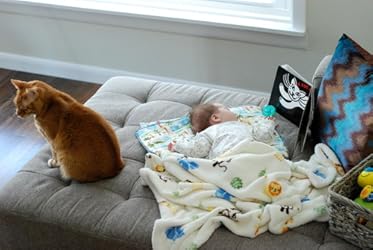
Find the location of a particular element. The image size is (373, 250). window sill is located at coordinates (149, 9).